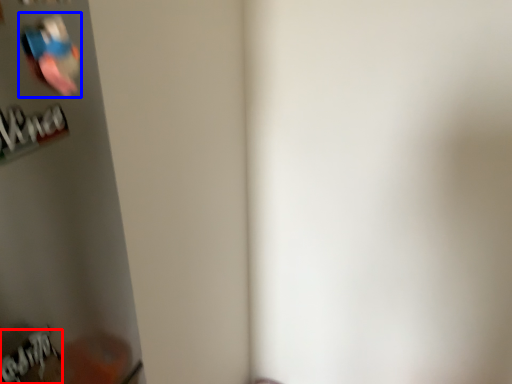
Question: Which point is further to the camera, writing (highlighted by a red box) or Wii controller (highlighted by a blue box)?

Choices:
 (A) writing
 (B) Wii controller

Answer: (A)